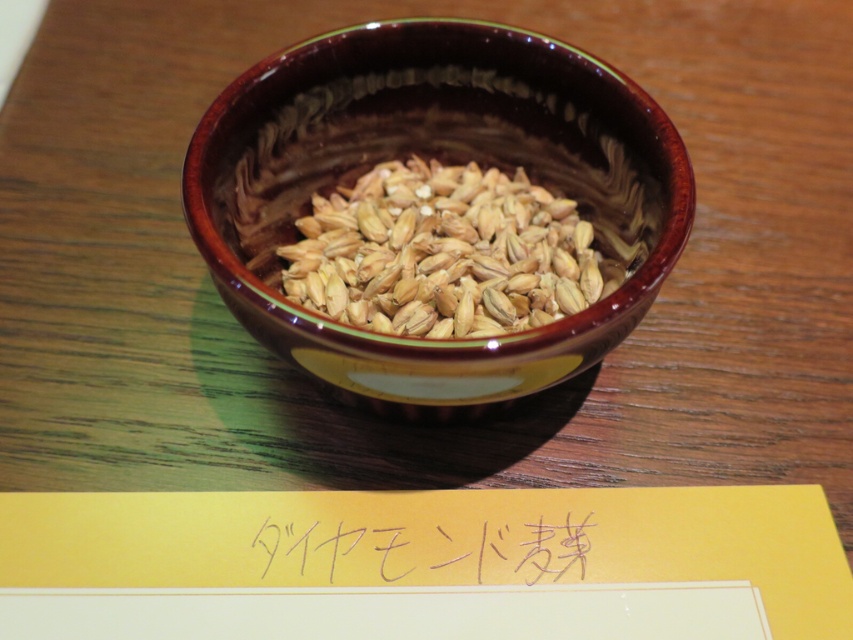
Question: Which point appears farthest from the camera in this image?

Choices:
 (A) (479, 314)
 (B) (531, 557)

Answer: (A)

Question: Which point appears closest to the camera in this image?

Choices:
 (A) (573, 520)
 (B) (283, 241)
 (C) (322, 312)

Answer: (A)

Question: Which of the following is the closest to the observer?

Choices:
 (A) brown matte grains at center
 (B) handwritten paper at center
 (C) brown glossy bowl at center

Answer: (C)

Question: Where is brown glossy bowl at center located in relation to brown matte grains at center in the image?

Choices:
 (A) right
 (B) left

Answer: (B)

Question: Is brown matte grains at center above handwritten paper at center?

Choices:
 (A) no
 (B) yes

Answer: (B)

Question: Can you confirm if brown matte grains at center is positioned to the right of handwritten paper at center?

Choices:
 (A) no
 (B) yes

Answer: (B)